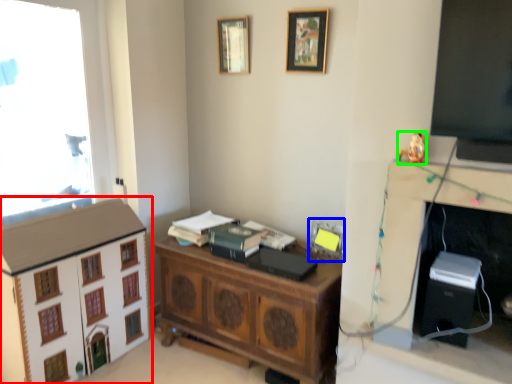
Question: Estimate the real-world distances between objects in this image. Which object is farther from dresser (highlighted by a red box), picture frame (highlighted by a blue box) or toy (highlighted by a green box)?

Choices:
 (A) picture frame
 (B) toy

Answer: (B)